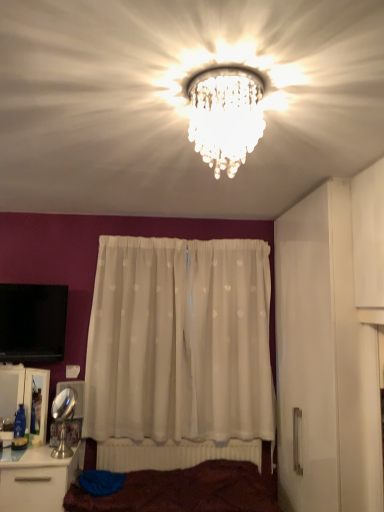
The width and height of the screenshot is (384, 512). Identify the location of blank area beneath black glossy television at left (from a real-world perspective). (33, 361).